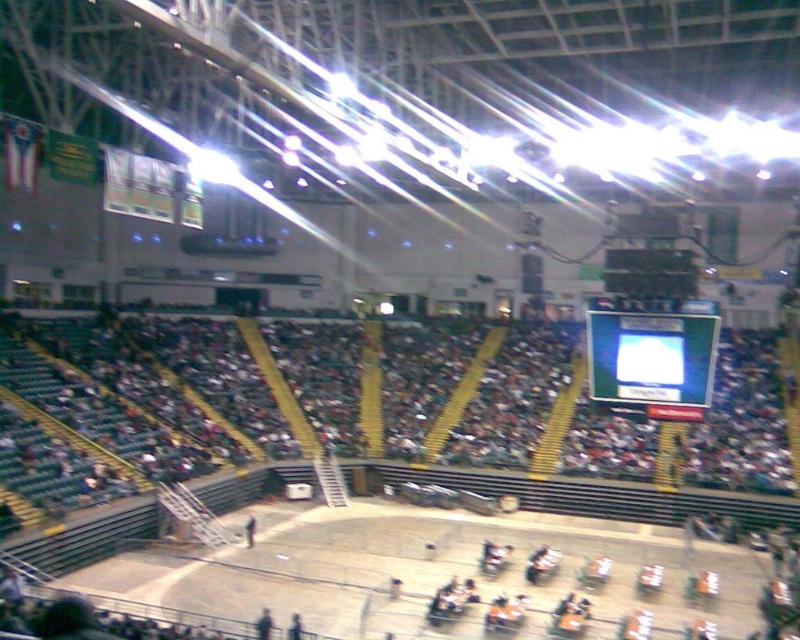
Between dark gray seats at center and matte black scoreboard at upper center, which one is positioned higher?

matte black scoreboard at upper center

Between dark gray seats at center and matte black scoreboard at upper center, which one appears on the right side from the viewer's perspective?

matte black scoreboard at upper center is more to the right.

Between point (576, 508) and point (698, 378), which one is positioned in front?

Point (698, 378)

What are the coordinates of `dark gray seats at center` in the screenshot? It's located at pyautogui.click(x=521, y=428).

Does dark gray seats at center have a greater width compared to black glossy scoreboard at upper center?

Correct, the width of dark gray seats at center exceeds that of black glossy scoreboard at upper center.

Find the location of a particular element. Image resolution: width=800 pixels, height=640 pixels. dark gray seats at center is located at coordinates (521, 428).

Is point (464, 481) farther from viewer compared to point (644, 266)?

No, it is in front of (644, 266).

This screenshot has width=800, height=640. In order to click on dark gray seats at center in this screenshot , I will do `click(521, 428)`.

Is matte black scoreboard at upper center thinner than black glossy scoreboard at upper center?

Yes, matte black scoreboard at upper center is thinner than black glossy scoreboard at upper center.

Can you confirm if matte black scoreboard at upper center is wider than black glossy scoreboard at upper center?

No.

Is point (688, 376) positioned after point (668, 259)?

That is False.

Find the location of `matte black scoreboard at upper center`. matte black scoreboard at upper center is located at coordinates (652, 356).